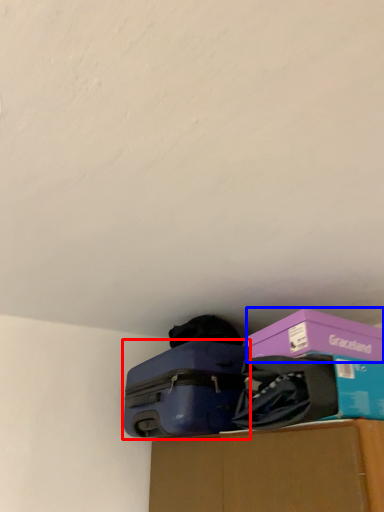
Question: Which object is closer to the camera taking this photo, suitcase (highlighted by a red box) or box (highlighted by a blue box)?

Choices:
 (A) suitcase
 (B) box

Answer: (B)